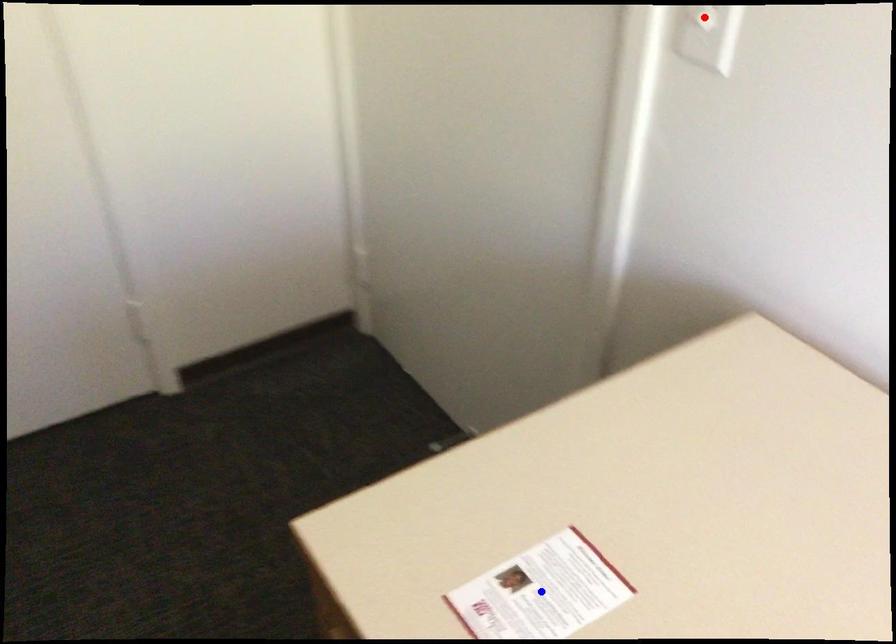
Question: Two points are marked on the image. Which point is closer to the camera?

Choices:
 (A) Blue point is closer.
 (B) Red point is closer.

Answer: (A)